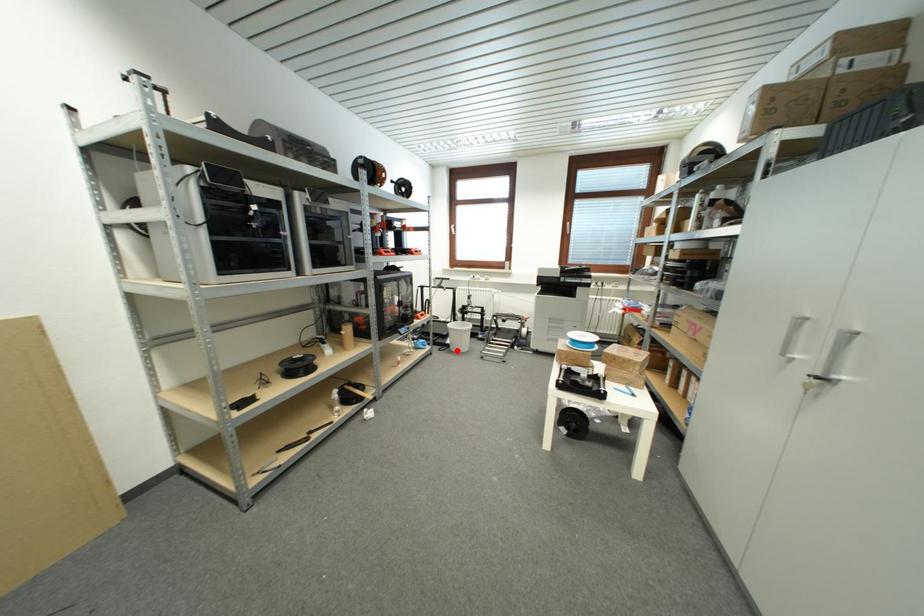
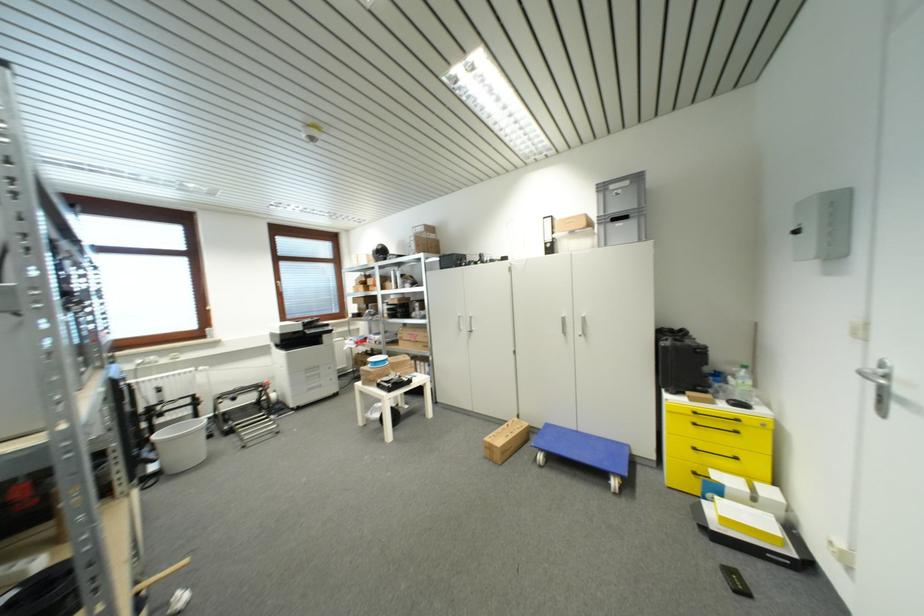
Question: I am providing you with two images of the same scene from different viewpoints. Image1 has a red point marked. In image2, the corresponding 3D location appears at what relative position? Reply with the corresponding letter.

Choices:
 (A) Closer
 (B) Farther

Answer: (A)